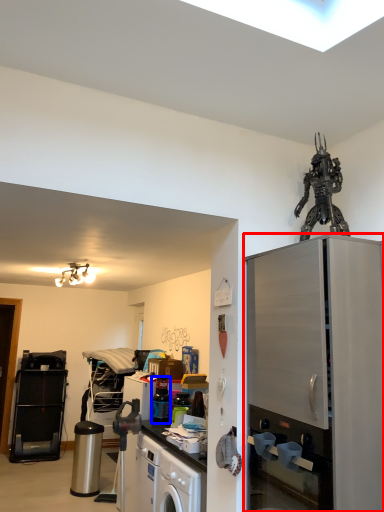
Question: Which of the following is the closest to the observer, cabinetry (highlighted by a red box) or appliance (highlighted by a blue box)?

Choices:
 (A) cabinetry
 (B) appliance

Answer: (A)